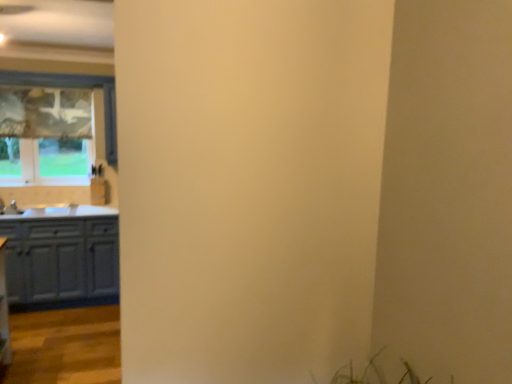
Question: Are matte white cabinets at left and matte glass window at left located far from each other?

Choices:
 (A) no
 (B) yes

Answer: (A)

Question: Is matte white cabinets at left facing away from matte glass window at left?

Choices:
 (A) no
 (B) yes

Answer: (A)

Question: Is matte white cabinets at left to the left of matte glass window at left from the viewer's perspective?

Choices:
 (A) no
 (B) yes

Answer: (A)

Question: Considering the relative sizes of matte white cabinets at left and matte glass window at left in the image provided, is matte white cabinets at left taller than matte glass window at left?

Choices:
 (A) yes
 (B) no

Answer: (B)

Question: Would you say matte white cabinets at left is outside matte glass window at left?

Choices:
 (A) yes
 (B) no

Answer: (A)

Question: Considering the relative positions of matte white cabinets at left and matte glass window at left in the image provided, is matte white cabinets at left behind matte glass window at left?

Choices:
 (A) no
 (B) yes

Answer: (A)

Question: From a real-world perspective, is matte glass window at left over matte white cabinets at left?

Choices:
 (A) no
 (B) yes

Answer: (B)

Question: Considering the relative sizes of matte glass window at left and matte white cabinets at left in the image provided, is matte glass window at left smaller than matte white cabinets at left?

Choices:
 (A) yes
 (B) no

Answer: (A)

Question: Can you confirm if matte glass window at left is bigger than matte white cabinets at left?

Choices:
 (A) no
 (B) yes

Answer: (A)

Question: Can you confirm if matte glass window at left is thinner than matte white cabinets at left?

Choices:
 (A) no
 (B) yes

Answer: (B)

Question: Is matte glass window at left not close to matte white cabinets at left?

Choices:
 (A) no
 (B) yes

Answer: (A)

Question: Is matte glass window at left positioned beyond the bounds of matte white cabinets at left?

Choices:
 (A) yes
 (B) no

Answer: (A)

Question: From the image's perspective, relative to matte glass window at left, is matte white cabinets at left above or below?

Choices:
 (A) below
 (B) above

Answer: (A)